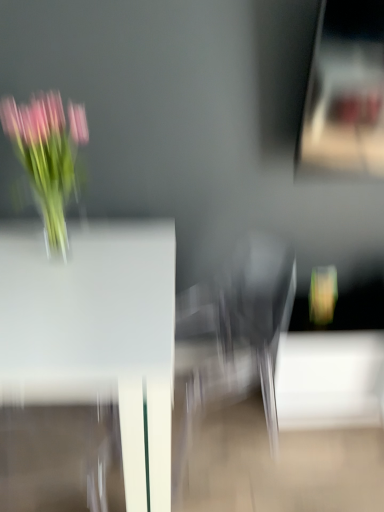
Question: Is pink glass vase at left completely or partially inside white glossy table at center?

Choices:
 (A) yes
 (B) no

Answer: (B)

Question: Is the surface of white glossy table at center in direct contact with pink glass vase at left?

Choices:
 (A) yes
 (B) no

Answer: (B)

Question: Is white glossy table at center to the left of pink glass vase at left from the viewer's perspective?

Choices:
 (A) no
 (B) yes

Answer: (B)

Question: Is white glossy table at center bigger than pink glass vase at left?

Choices:
 (A) no
 (B) yes

Answer: (B)

Question: Is the depth of white glossy table at center less than that of pink glass vase at left?

Choices:
 (A) yes
 (B) no

Answer: (A)

Question: From the image's perspective, would you say white glossy table at center is positioned over pink glass vase at left?

Choices:
 (A) no
 (B) yes

Answer: (A)

Question: From the image's perspective, is pink glass vase at left on white glossy table at center?

Choices:
 (A) no
 (B) yes

Answer: (B)

Question: Considering the relative positions of pink glass vase at left and white glossy table at center in the image provided, is pink glass vase at left to the right of white glossy table at center from the viewer's perspective?

Choices:
 (A) yes
 (B) no

Answer: (A)

Question: From the image's perspective, would you say pink glass vase at left is shown under white glossy table at center?

Choices:
 (A) no
 (B) yes

Answer: (A)

Question: Does pink glass vase at left have a lesser width compared to white glossy table at center?

Choices:
 (A) yes
 (B) no

Answer: (A)

Question: Is white glossy table at center at the back of pink glass vase at left?

Choices:
 (A) yes
 (B) no

Answer: (B)

Question: Does pink glass vase at left turn towards white glossy table at center?

Choices:
 (A) yes
 (B) no

Answer: (B)

Question: Is white glossy table at center spatially inside pink glass vase at left, or outside of it?

Choices:
 (A) inside
 (B) outside

Answer: (B)